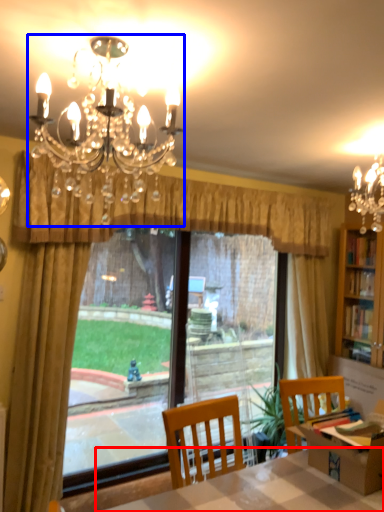
Question: Which object is further to the camera taking this photo, table (highlighted by a red box) or lamp (highlighted by a blue box)?

Choices:
 (A) table
 (B) lamp

Answer: (A)